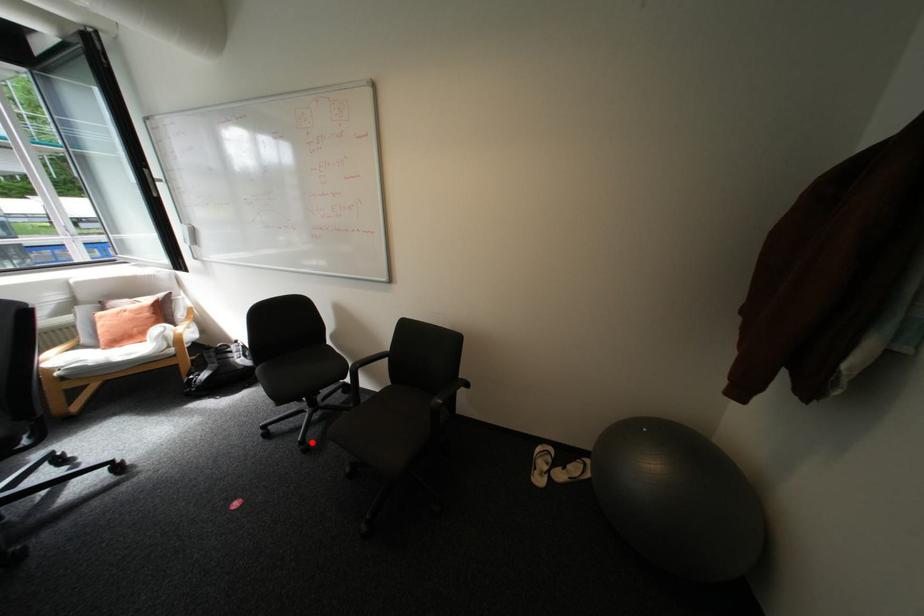
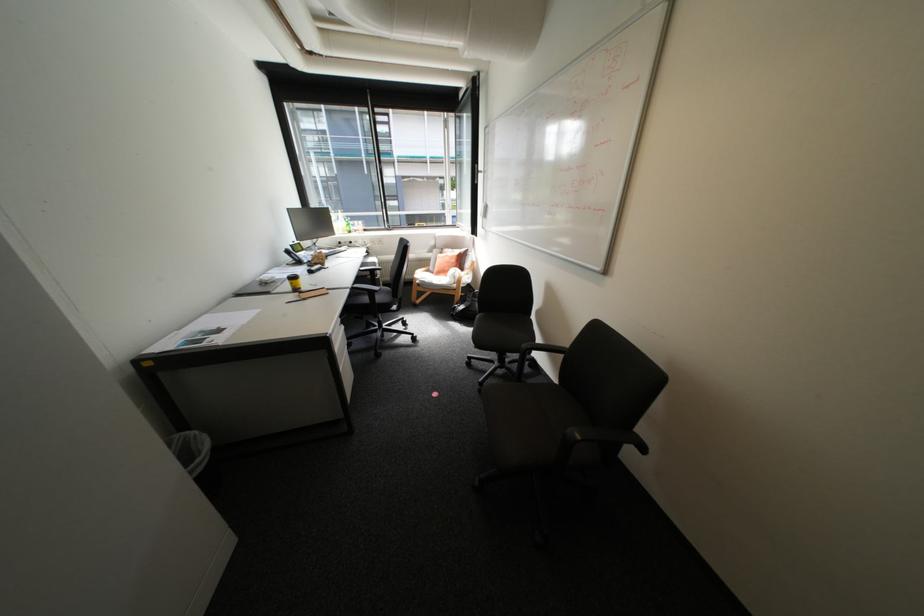
Find the pixel in the second image that matches the highlighted location in the first image.

(491, 384)